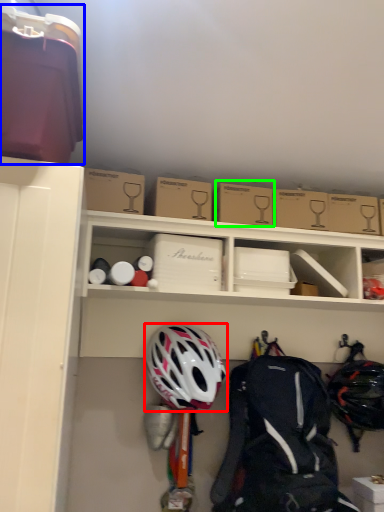
Question: Estimate the real-world distances between objects in this image. Which object is farther from helmet (highlighted by a red box), box (highlighted by a blue box) or cardboard box (highlighted by a green box)?

Choices:
 (A) box
 (B) cardboard box

Answer: (A)